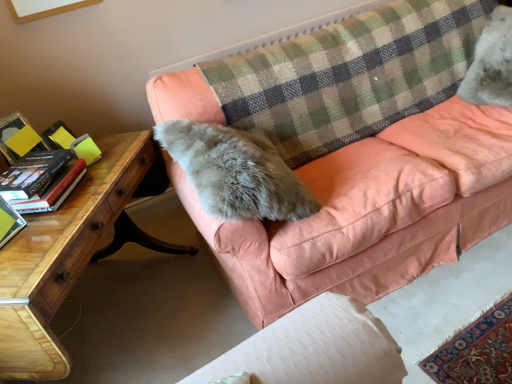
Find the location of a particular element. empty space that is to the right of green matte book at left, positioned as the 1th paperback book in front-to-back order is located at coordinates (56, 227).